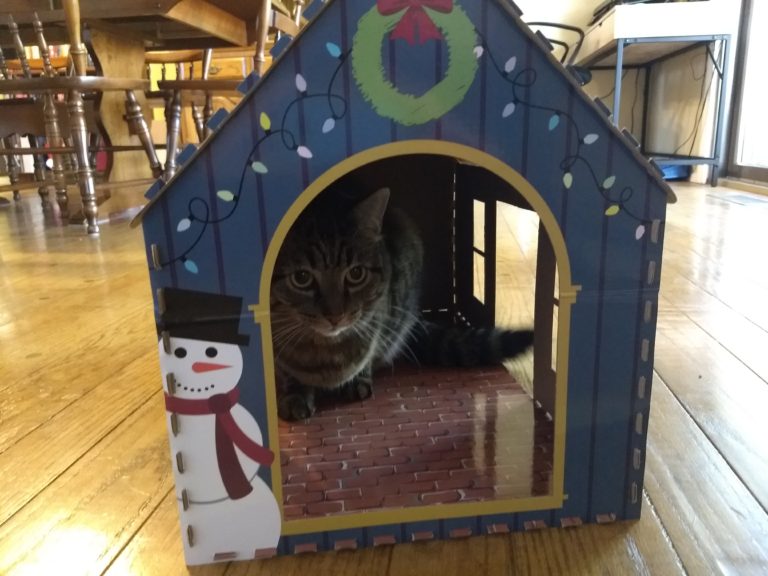
Locate an element on the screen. wood table is located at coordinates (212, 22).